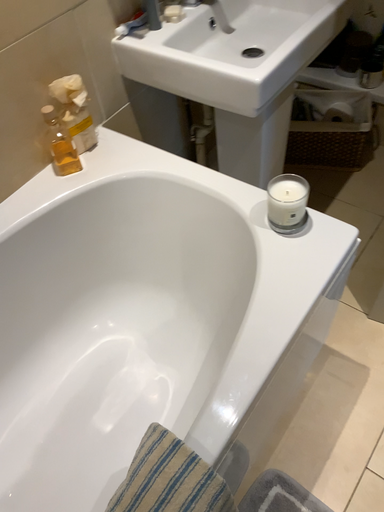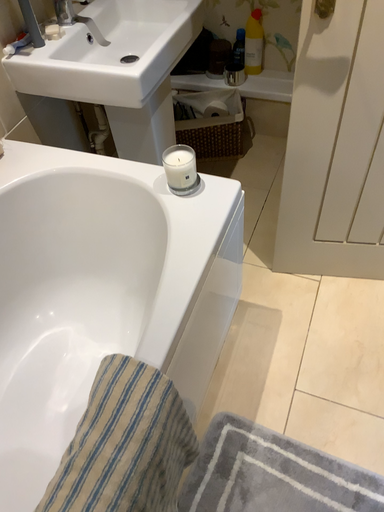
Question: Which way did the camera rotate in the video?

Choices:
 (A) rotated left
 (B) rotated right

Answer: (B)